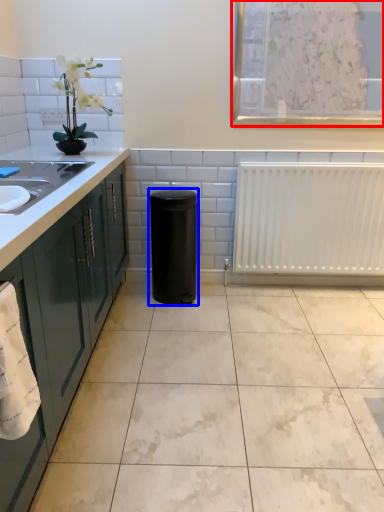
Question: Which object appears closest to the camera in this image, window screen (highlighted by a red box) or appliance (highlighted by a blue box)?

Choices:
 (A) window screen
 (B) appliance

Answer: (A)